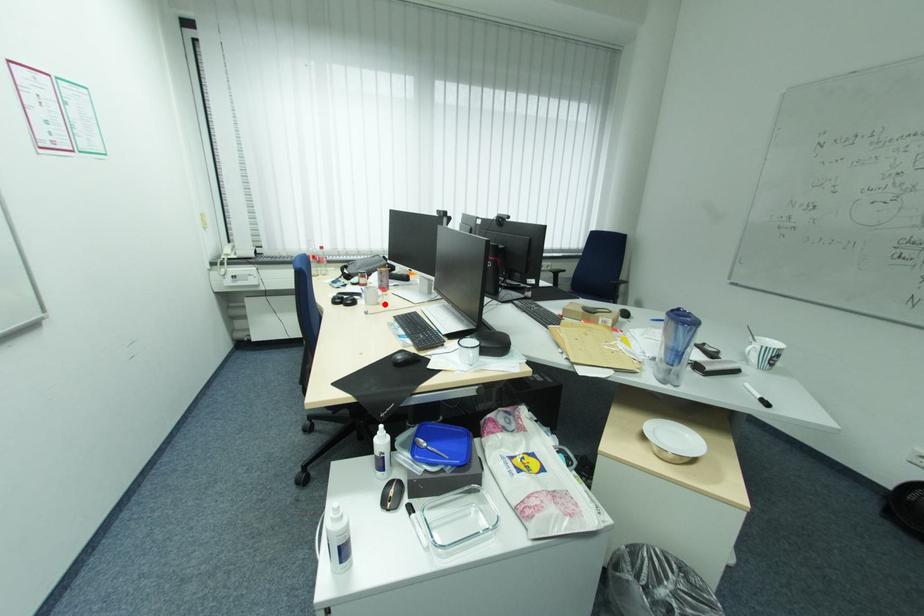
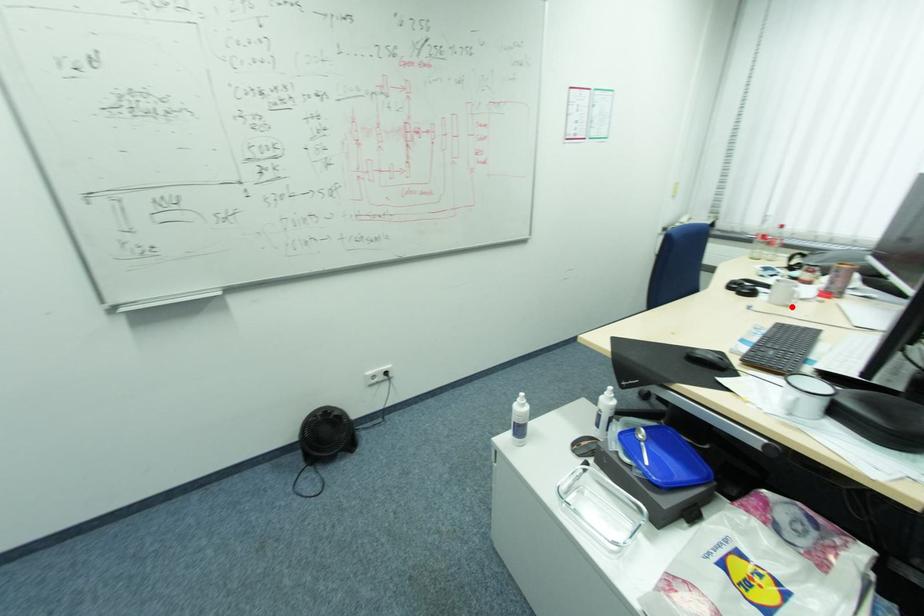
I am providing you with two images of the same scene from different viewpoints. A red point is marked on the first image and another point is marked on the second image. Is the red point in image1 aligned with the point shown in image2?

Yes